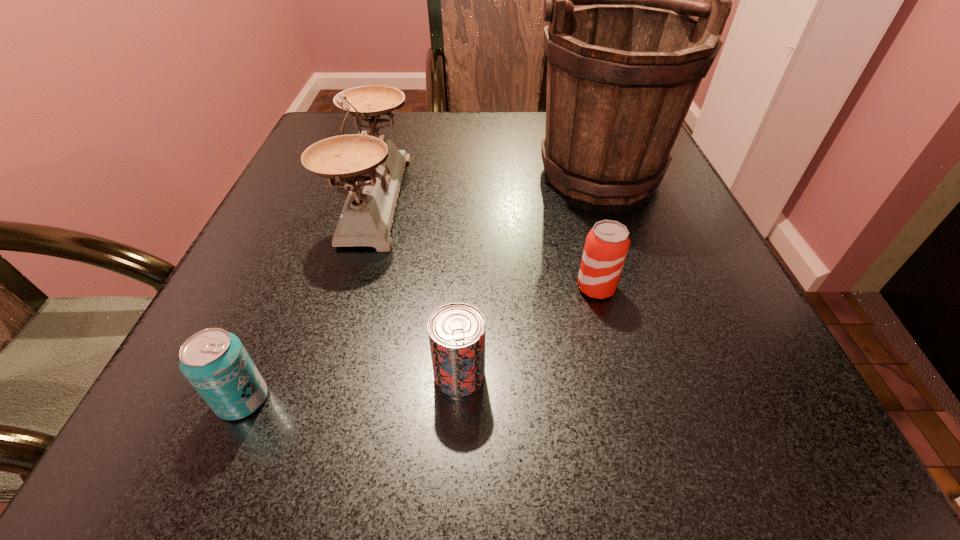
The height and width of the screenshot is (540, 960). Find the location of `free space located on the back of the farthest beer can`. free space located on the back of the farthest beer can is located at coordinates (586, 248).

Locate an element on the screen. vacant space positioned on the back of the leftmost beer can is located at coordinates (286, 294).

This screenshot has height=540, width=960. I want to click on free space located on the left of the second beer can from left to right, so click(x=229, y=375).

Where is `bucket present at the far edge`? bucket present at the far edge is located at coordinates (622, 73).

Identify the location of scale that is at the far edge. (372, 168).

Image resolution: width=960 pixels, height=540 pixels. Identify the location of object that is at the near edge. (214, 361).

Locate an element on the screen. This screenshot has width=960, height=540. scale that is at the left edge is located at coordinates pyautogui.click(x=372, y=168).

Locate an element on the screen. The image size is (960, 540). beer can at the left edge is located at coordinates (214, 361).

This screenshot has height=540, width=960. Identify the location of object at the right edge. (622, 73).

Find the location of a particular element. The height and width of the screenshot is (540, 960). object that is at the far left corner is located at coordinates (372, 168).